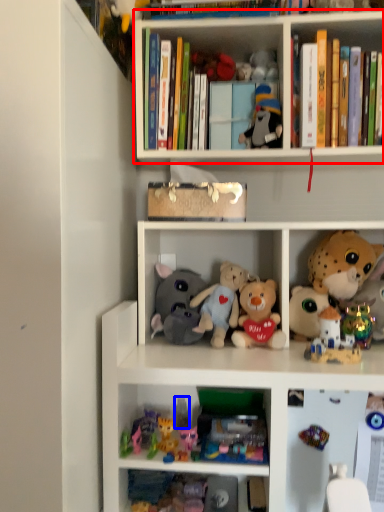
Question: Which point is closer to the camera, shelf (highlighted by a red box) or toy (highlighted by a blue box)?

Choices:
 (A) shelf
 (B) toy

Answer: (A)